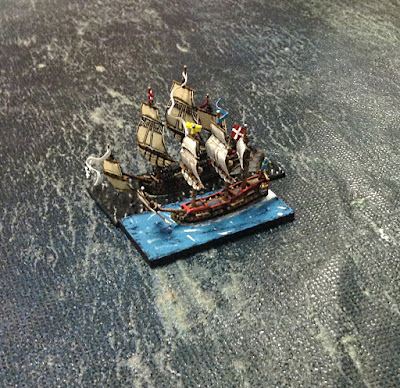
Identify the location of painting. This screenshot has width=400, height=388. (221, 150).